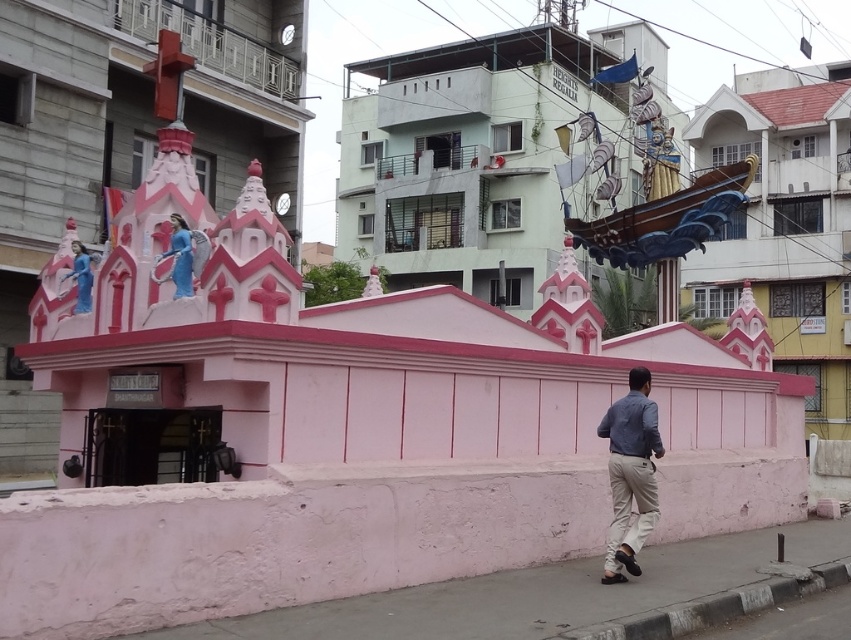
Is denim shirt at lower right shorter than matte blue statue at upper center?

No.

Does denim shirt at lower right have a smaller size compared to matte blue statue at upper center?

No.

Which is behind, point (624, 518) or point (176, 282)?

The point (624, 518) is behind.

You are a GUI agent. You are given a task and a screenshot of the screen. Output one action in this format:
    pyautogui.click(x=<x>, y=<y>)
    Task: Click on the denim shirt at lower right
    This screenshot has width=851, height=640.
    Given the screenshot: What is the action you would take?
    pyautogui.click(x=630, y=474)

Is gray concrete pavement at lower right below blue glossy statue at upper left?

Indeed, gray concrete pavement at lower right is positioned under blue glossy statue at upper left.

Which is above, gray concrete pavement at lower right or blue glossy statue at upper left?

Positioned higher is blue glossy statue at upper left.

Which is in front, point (545, 620) or point (75, 307)?

Point (545, 620) is more forward.

The image size is (851, 640). In order to click on gray concrete pavement at lower right in this screenshot , I will do `click(540, 595)`.

Is point (584, 588) more distant than point (643, 378)?

No, it is not.

Consider the image. Who is lower down, gray concrete pavement at lower right or denim shirt at lower right?

gray concrete pavement at lower right is below.

Is point (592, 586) positioned after point (638, 513)?

No, (592, 586) is in front of (638, 513).

At what (x,y) coordinates should I click in order to perform the action: click on gray concrete pavement at lower right. Please return your answer as a coordinate pair (x, y). Image resolution: width=851 pixels, height=640 pixels. Looking at the image, I should click on (540, 595).